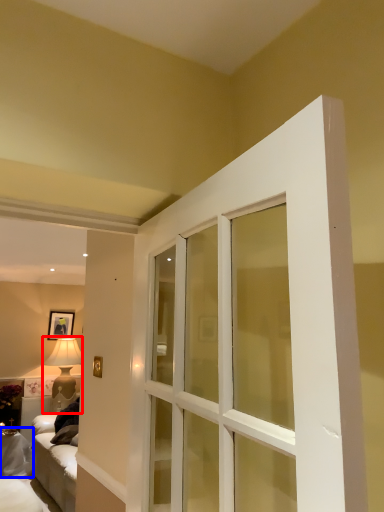
Question: Among these objects, which one is nearest to the camera, lamp (highlighted by a red box) or furniture (highlighted by a blue box)?

Choices:
 (A) lamp
 (B) furniture

Answer: (B)